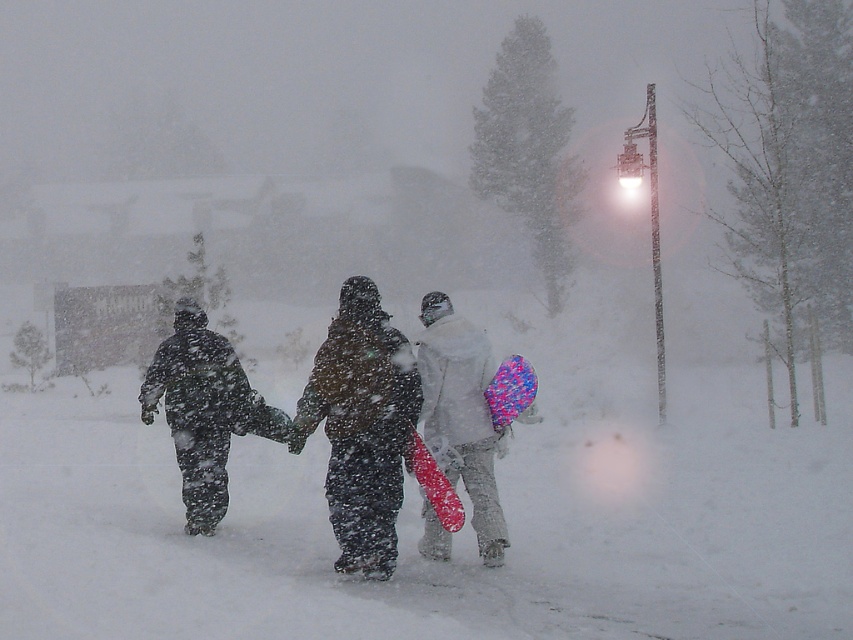
Question: Which point is closer to the camera?

Choices:
 (A) shiny red snowboard at center
 (B) matte pink snowboard at center
 (C) dark matte snowsuit at center

Answer: (A)

Question: Is dark matte snowsuit at center above matte pink snowboard at center?

Choices:
 (A) yes
 (B) no

Answer: (B)

Question: Is dark matte snowsuit at center positioned behind shiny red snowboard at center?

Choices:
 (A) yes
 (B) no

Answer: (A)

Question: Is dark matte snowsuit at center to the right of shiny red snowboard at center from the viewer's perspective?

Choices:
 (A) yes
 (B) no

Answer: (B)

Question: Which object appears farthest from the camera in this image?

Choices:
 (A) shiny red snowboard at center
 (B) matte pink snowboard at center

Answer: (B)

Question: Which point is closer to the camera?

Choices:
 (A) (431, 477)
 (B) (432, 499)
 (C) (376, 388)

Answer: (C)